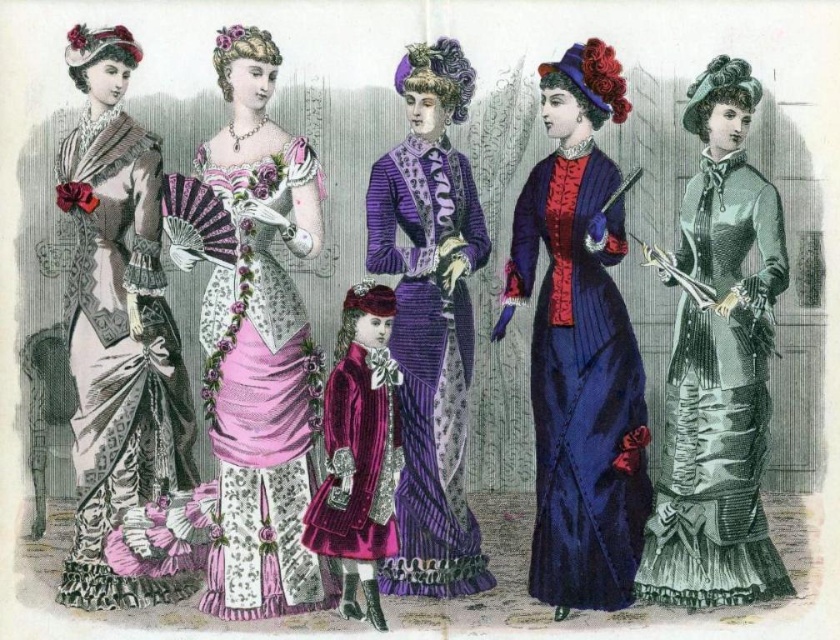
Question: Can you confirm if silvery-green satin dress at right is bigger than velvet purple dress at center?

Choices:
 (A) yes
 (B) no

Answer: (A)

Question: Considering the real-world distances, which object is closest to the matte silver dress at left?

Choices:
 (A) velvet blue dress at center
 (B) velvet purple dress at center
 (C) pink satin dress at center
 (D) velvet maroon coat at center

Answer: (C)

Question: Does matte silver dress at left have a lesser width compared to velvet maroon coat at center?

Choices:
 (A) yes
 (B) no

Answer: (B)

Question: Can you confirm if matte silver dress at left is thinner than velvet maroon coat at center?

Choices:
 (A) yes
 (B) no

Answer: (B)

Question: Which of the following is the farthest from the observer?

Choices:
 (A) (701, 88)
 (B) (618, 486)
 (C) (476, 260)

Answer: (C)

Question: Based on their relative distances, which object is nearer to the velvet purple dress at center?

Choices:
 (A) silvery-green satin dress at right
 (B) pink satin dress at center
 (C) velvet maroon coat at center

Answer: (C)